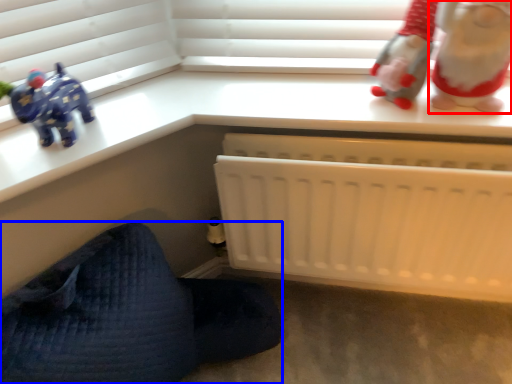
Question: Which object appears closest to the camera in this image, toy (highlighted by a red box) or furniture (highlighted by a blue box)?

Choices:
 (A) toy
 (B) furniture

Answer: (B)